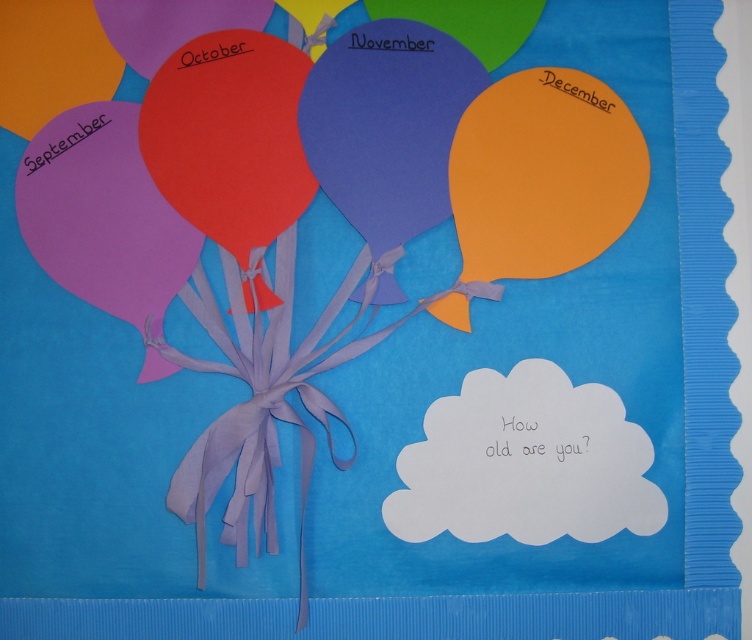
Question: Which object is farther from the camera taking this photo?

Choices:
 (A) matte orange balloon at upper right
 (B) orange paper balloon at upper right
 (C) orange paper balloon at upper left
 (D) matte black balloon at upper center

Answer: (A)

Question: Is purple paper balloon at left positioned at the back of matte black balloon at upper center?

Choices:
 (A) no
 (B) yes

Answer: (A)

Question: Which object is positioned farthest from the orange paper balloon at upper right?

Choices:
 (A) purple paper at left
 (B) white paper cloud at lower center
 (C) matte orange balloon at upper right
 (D) purple paper balloon at left

Answer: (A)

Question: Does white paper cloud at lower center appear under matte orange balloon at upper center?

Choices:
 (A) no
 (B) yes

Answer: (B)

Question: Can you confirm if purple paper balloon at left is positioned to the left of matte black balloon at upper center?

Choices:
 (A) yes
 (B) no

Answer: (A)

Question: Which point is closer to the camera?

Choices:
 (A) matte black balloon at upper center
 (B) matte orange balloon at upper right

Answer: (A)